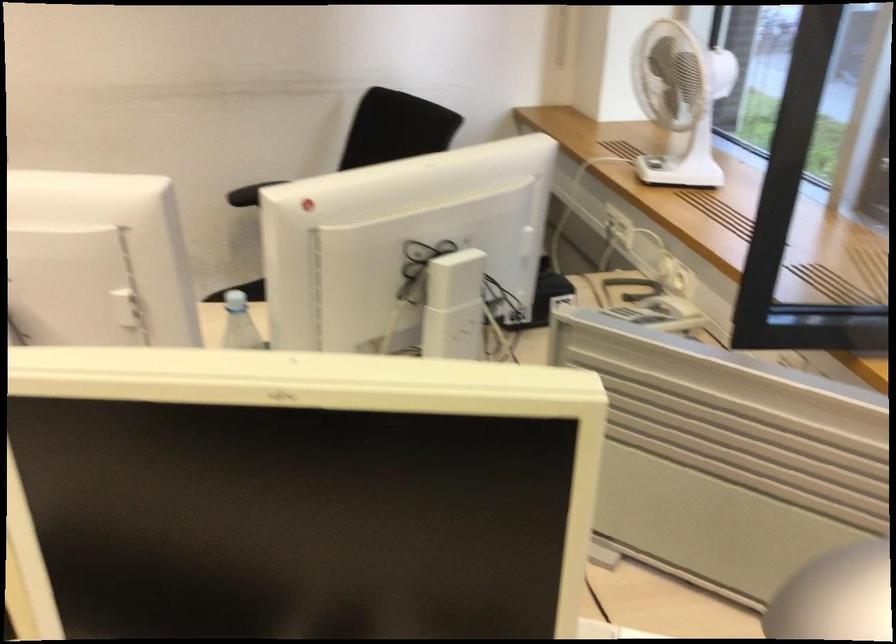
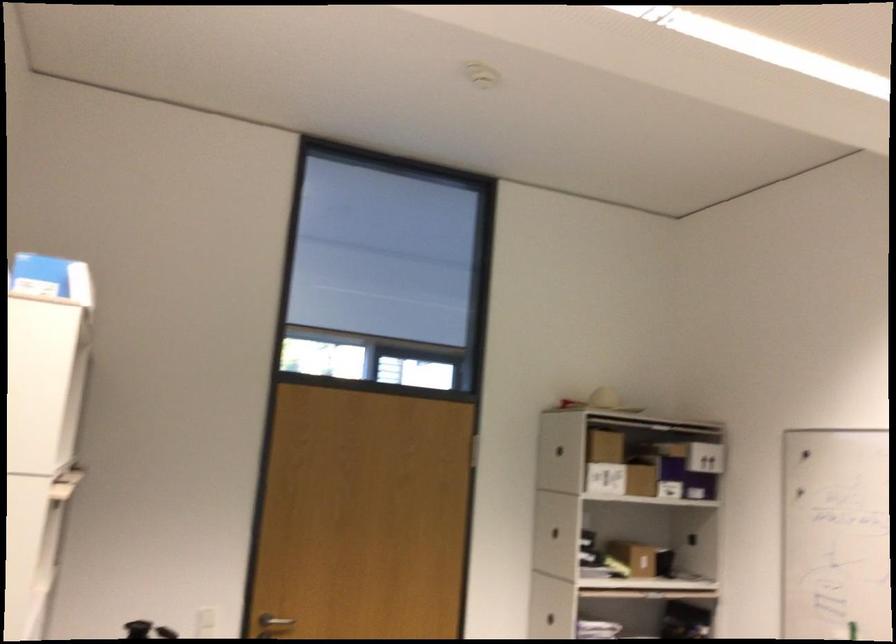
Question: Based on the continuous images, in which direction is the camera rotating? Reply with the corresponding letter.

Choices:
 (A) Left
 (B) Right
 (C) Up
 (D) Down

Answer: (A)